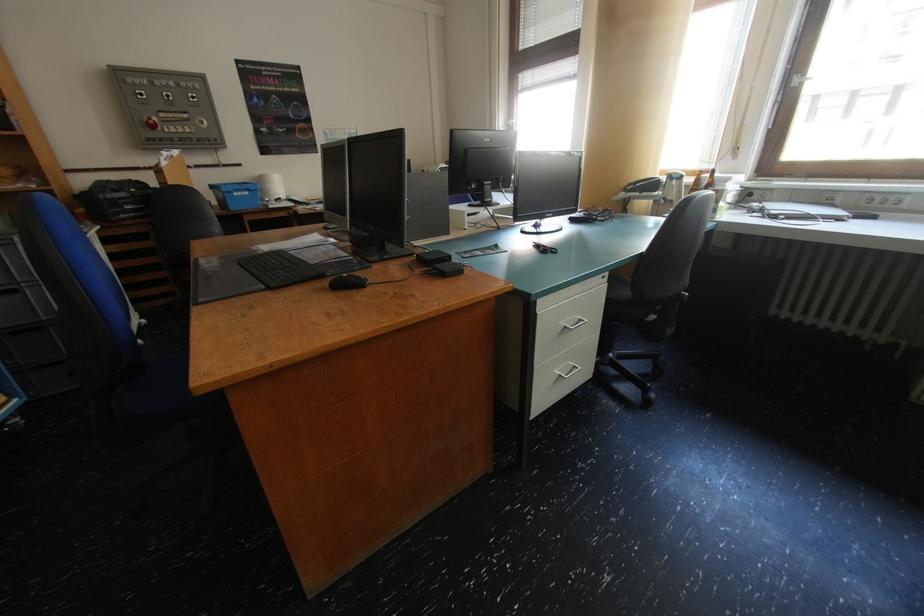
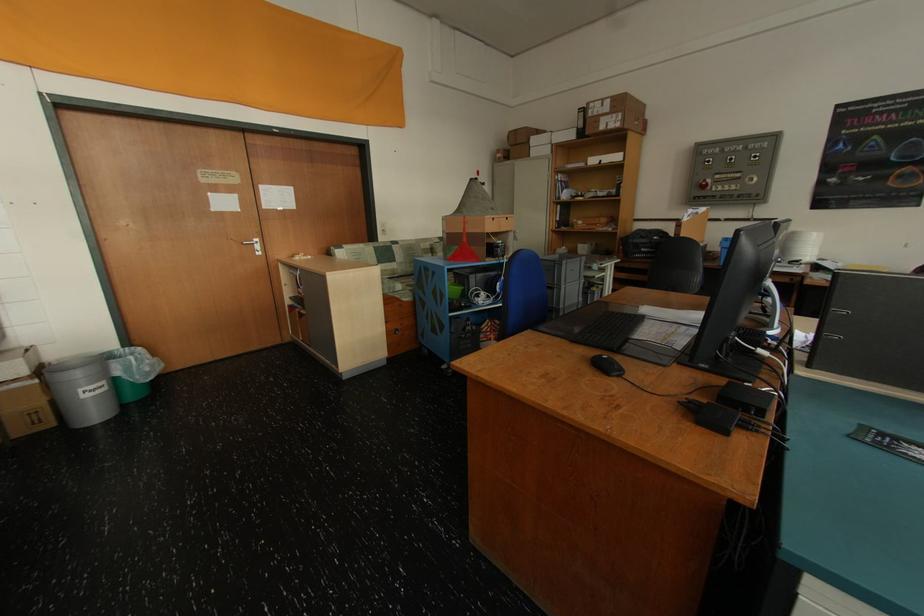
The point at (28, 285) is marked in the first image. Where is the corresponding point in the second image?

(563, 286)